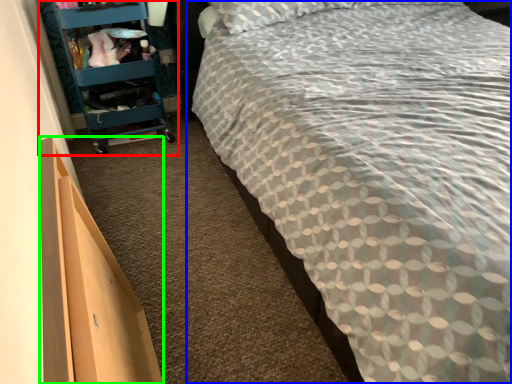
Question: Which is nearer to the furniture (highlighted by a red box)? bed (highlighted by a blue box) or drawer (highlighted by a green box).

Choices:
 (A) bed
 (B) drawer

Answer: (A)